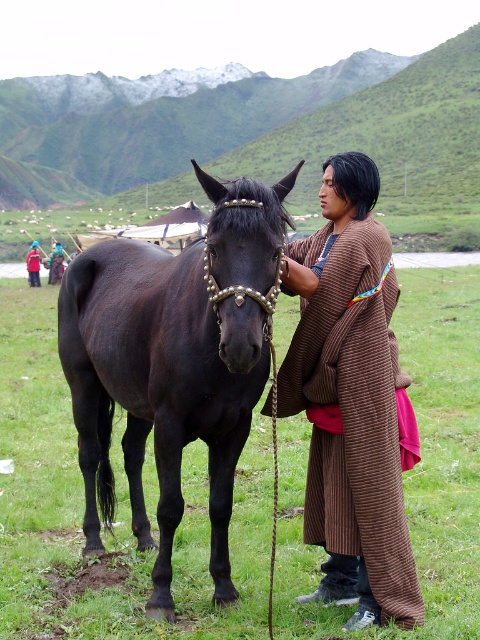
You are a photographer planning to take a portrait of the shiny black horse at center and the brown textured robe at center. Since you want to capture their full height, which one requires a wider vertical framing in your camera?

The shiny black horse at center has a greater height compared to the brown textured robe at center, so it requires a wider vertical framing in the camera.

You are a photographer positioned at the front of the scene. You want to take a photo that includes both the shiny black horse at center and the brown textured robe at center. Which object should you focus on first to ensure both are in clear view?

The shiny black horse at center is closer to the viewer than the brown textured robe at center, so you should focus on the shiny black horse at center first to ensure both are in clear view.

You are a photographer positioned at the edge of the field. You want to take a photo of both the brown textured robe at center and the red cotton robe at center. Which robe should you focus on first to ensure both are in clear view?

You should focus on the brown textured robe at center first since it is closer to you than the red cotton robe at center, ensuring both will be in clear view when focused properly.